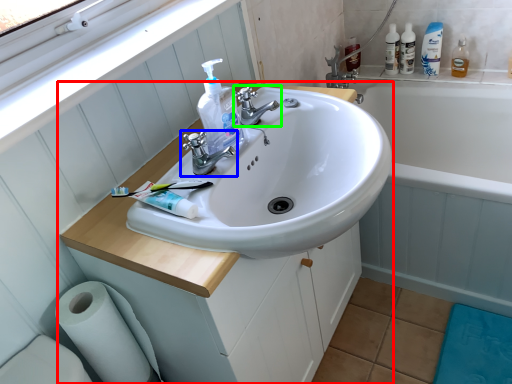
Question: Based on their relative distances, which object is farther from bathroom cabinet (highlighted by a red box)? Choose from tap (highlighted by a blue box) and tap (highlighted by a green box).

Choices:
 (A) tap
 (B) tap

Answer: (B)